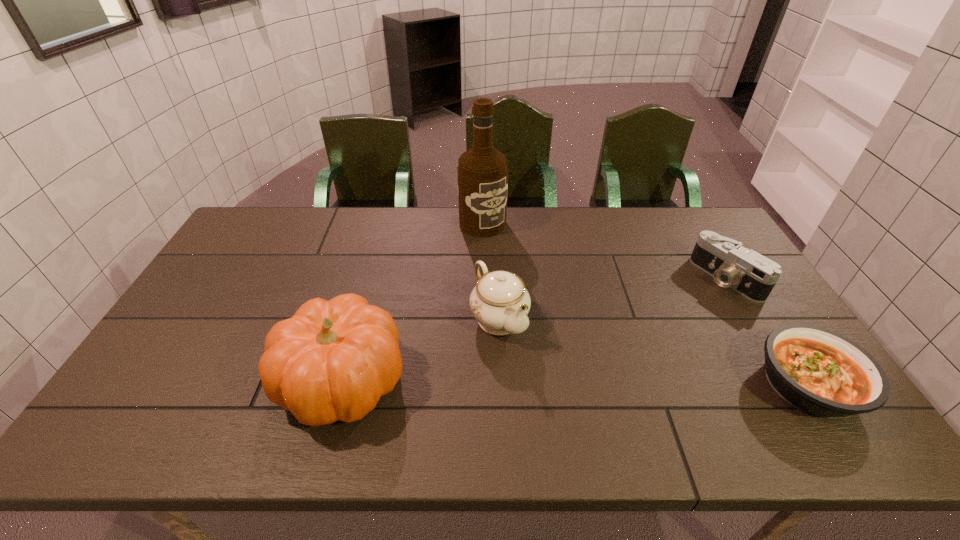
Locate an element on the screen. This screenshot has width=960, height=540. vacant space located on the label of the alcohol is located at coordinates (505, 248).

Where is `free space located on the label of the alcohol`? The image size is (960, 540). free space located on the label of the alcohol is located at coordinates (501, 244).

Where is `vacant space situated 0.340m on the lens of the fourth tallest object`? The width and height of the screenshot is (960, 540). vacant space situated 0.340m on the lens of the fourth tallest object is located at coordinates (635, 341).

The width and height of the screenshot is (960, 540). In order to click on vacant space located on the lens of the fourth tallest object in this screenshot , I will do `click(702, 299)`.

Locate an element on the screen. The image size is (960, 540). free space located on the lens of the fourth tallest object is located at coordinates (630, 345).

Identify the location of vacant space located 0.080m at the spout of the chinaware. The height and width of the screenshot is (540, 960). (533, 366).

In order to click on free location located 0.050m at the spout of the chinaware in this screenshot , I will do `click(526, 358)`.

Image resolution: width=960 pixels, height=540 pixels. Identify the location of object at the far edge. (482, 171).

Locate an element on the screen. The image size is (960, 540). pumpkin that is positioned at the near edge is located at coordinates (332, 360).

Locate an element on the screen. The width and height of the screenshot is (960, 540). stew that is positioned at the near edge is located at coordinates (818, 371).